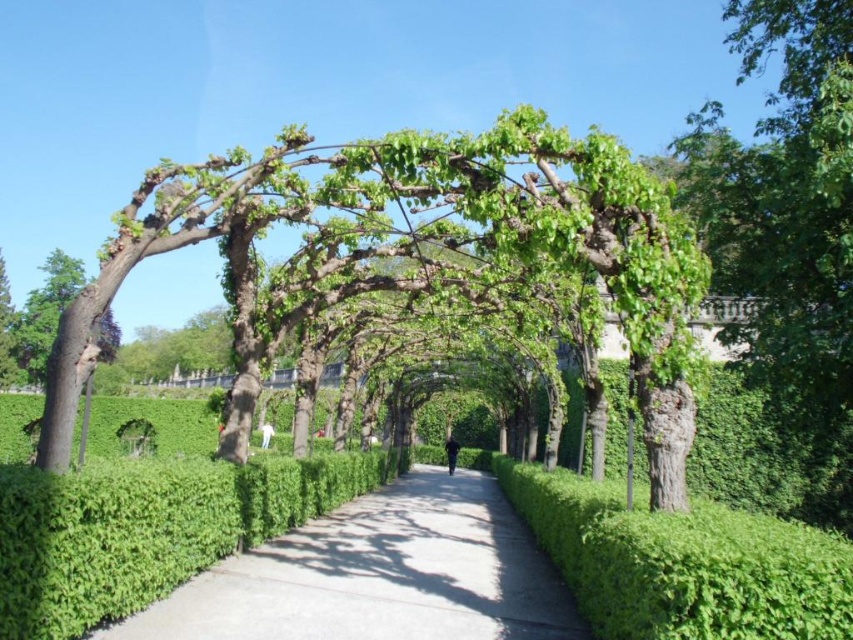
You are a gardener who needs to place a 1.5 meter tall statue on the green concrete pavement at center. Can the statue be placed there without exceeding the height of the smooth brown tree trunk at left?

The green concrete pavement at center is shorter than the smooth brown tree trunk at left. Since the statue is 1.5 meters tall, it can be placed there as long as its height does not exceed the tree trunk. However, since the pavement itself is shorter, but the tree trunk is taller, the statue can be placed there as its height is only 1.5 meters and the tree trunk is taller than the pavement, so the statue won

You are standing at the entrance of the garden pathway and want to locate the green leafy tree at center. According to the coordinates provided, where should you look relative to your position?

The green leafy tree at center is located at coordinates point (x=419, y=253), which means it is positioned slightly to the left and forward from your current position at the entrance.

You are standing at the entrance of the garden pathway and want to walk towards the green leafy tree at center and the green concrete pavement at center. Which object will you encounter first?

The green leafy tree at center will be encountered first because it is closer to the viewer compared to the green concrete pavement at center.